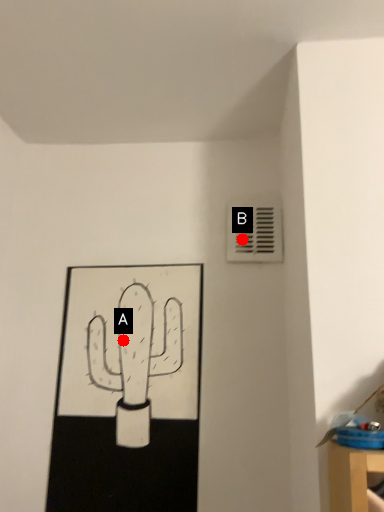
Question: Two points are circled on the image, labeled by A and B beside each circle. Which point is closer to the camera?

Choices:
 (A) A is closer
 (B) B is closer

Answer: (A)